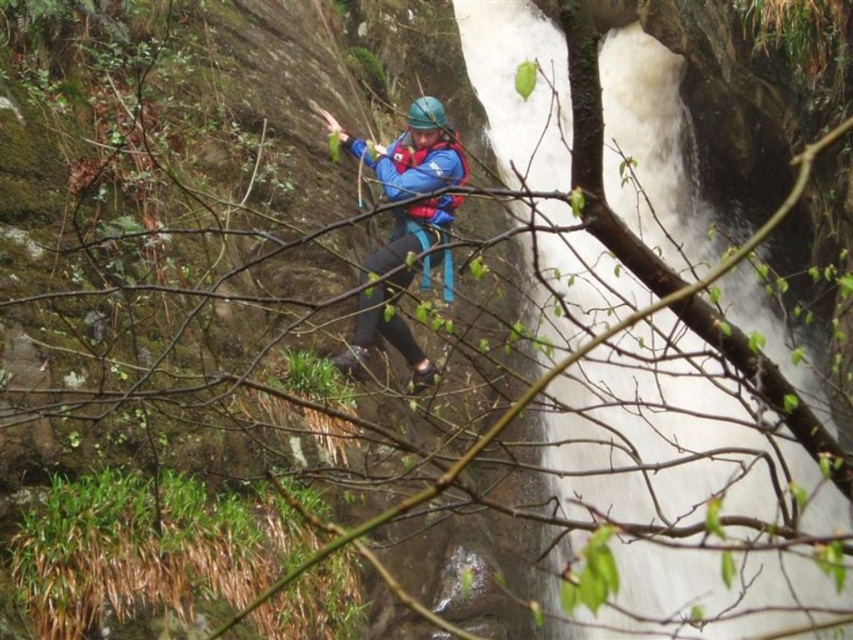
You are a safety inspector assessing the rappelling setup. The white frothy water at center and the blue matte life vest at center are both visible from your vantage point. Which object appears wider in the image?

The white frothy water at center appears wider than the blue matte life vest at center because its width surpasses the latter.

You are a safety inspector assessing the rappelling setup. Based on the image, which object is taller between the white frothy water at center and the blue matte life vest at center?

The white frothy water at center has a greater height compared to the blue matte life vest at center.